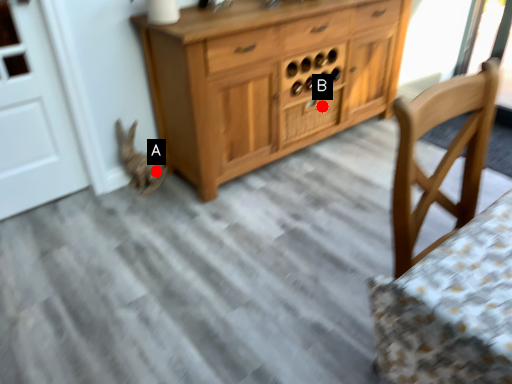
Question: Two points are circled on the image, labeled by A and B beside each circle. Which point is closer to the camera taking this photo?

Choices:
 (A) A is closer
 (B) B is closer

Answer: (A)